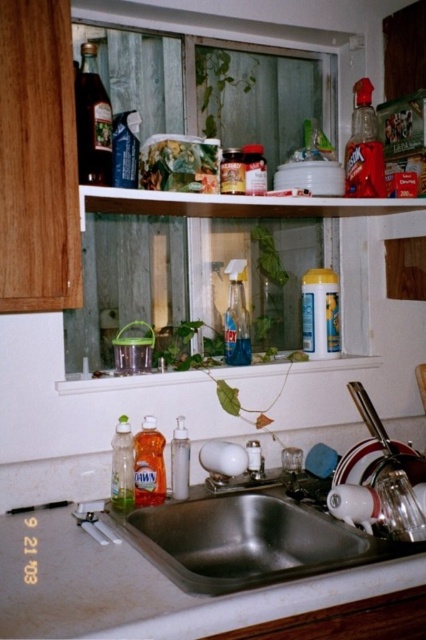
Identify the location of translucent plastic bottle at upper right. This screenshot has width=426, height=640. click(363, 147).

Does translucent plastic bottle at upper right have a lesser width compared to yellow matte container at upper center?

Yes, translucent plastic bottle at upper right is thinner than yellow matte container at upper center.

The height and width of the screenshot is (640, 426). What are the coordinates of `translucent plastic bottle at upper right` in the screenshot? It's located at (363, 147).

Is point (235, 355) behind point (244, 193)?

Yes.

The width and height of the screenshot is (426, 640). Describe the element at coordinates (236, 316) in the screenshot. I see `clear glass spray bottle at center` at that location.

In order to click on clear glass spray bottle at center in this screenshot , I will do `click(236, 316)`.

Between translucent plastic jar at center and brushed metal faucet at sink center, which one appears on the left side from the viewer's perspective?

translucent plastic jar at center

Can you confirm if translucent plastic jar at center is positioned to the right of brushed metal faucet at sink center?

No, translucent plastic jar at center is not to the right of brushed metal faucet at sink center.

Is point (224, 154) more distant than point (258, 456)?

No.

Find the location of a particular element. Image resolution: width=426 pixels, height=640 pixels. translucent plastic jar at center is located at coordinates (232, 172).